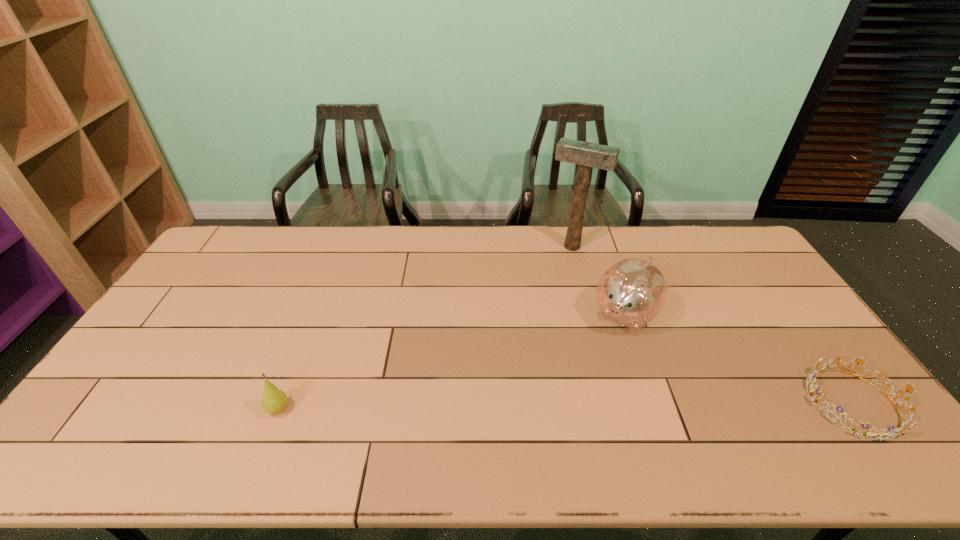
The image size is (960, 540). In order to click on unoccupied position between the tallest object and the tiara in this screenshot , I will do `click(712, 325)`.

I want to click on vacant space in between the pear and the farthest object, so click(x=425, y=328).

Identify the location of free spot between the tiara and the mallet. (712, 325).

The height and width of the screenshot is (540, 960). In order to click on unoccupied area between the farthest object and the third nearest object in this screenshot , I will do `click(598, 281)`.

Locate an element on the screen. vacant area between the piggy bank and the second shortest object is located at coordinates (451, 362).

Locate which object ranks third in proximity to the tiara. Please provide its 2D coordinates. Your answer should be formatted as a tuple, i.e. [(x, y)], where the tuple contains the x and y coordinates of a point satisfying the conditions above.

[(274, 401)]

You are a GUI agent. You are given a task and a screenshot of the screen. Output one action in this format:
    pyautogui.click(x=<x>, y=<y>)
    Task: Click on the closest object relative to the pear
    
    Given the screenshot: What is the action you would take?
    pyautogui.click(x=632, y=292)

Image resolution: width=960 pixels, height=540 pixels. I want to click on vacant space that satisfies the following two spatial constraints: 1. on the back side of the rightmost object; 2. on the front-facing side of the pear, so click(281, 402).

The width and height of the screenshot is (960, 540). Find the location of `free space that satisfies the following two spatial constraints: 1. on the front side of the piggy bank; 2. on the front-facing side of the tiara`. free space that satisfies the following two spatial constraints: 1. on the front side of the piggy bank; 2. on the front-facing side of the tiara is located at coordinates (655, 402).

Where is `vacant region that satisfies the following two spatial constraints: 1. on the back side of the third nearest object; 2. on the left side of the third tallest object`? The width and height of the screenshot is (960, 540). vacant region that satisfies the following two spatial constraints: 1. on the back side of the third nearest object; 2. on the left side of the third tallest object is located at coordinates (315, 315).